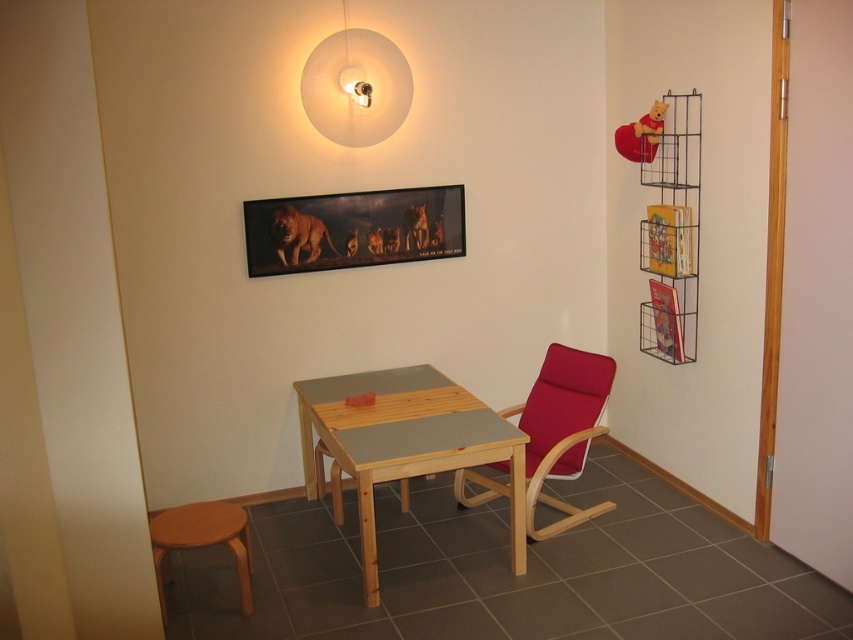
In the scene shown: Between light brown wooden table at center and metallic glossy picture frame at upper center, which one has more height?

light brown wooden table at center

You are a GUI agent. You are given a task and a screenshot of the screen. Output one action in this format:
    pyautogui.click(x=<x>, y=<y>)
    Task: Click on the light brown wooden table at center
    This screenshot has width=853, height=640.
    Given the screenshot: What is the action you would take?
    pyautogui.click(x=405, y=442)

Between light brown wooden table at center and matte red chair at center, which one appears on the right side from the viewer's perspective?

From the viewer's perspective, matte red chair at center appears more on the right side.

Can you confirm if light brown wooden table at center is wider than matte red chair at center?

Indeed, light brown wooden table at center has a greater width compared to matte red chair at center.

You are a GUI agent. You are given a task and a screenshot of the screen. Output one action in this format:
    pyautogui.click(x=<x>, y=<y>)
    Task: Click on the light brown wooden table at center
    
    Given the screenshot: What is the action you would take?
    pyautogui.click(x=405, y=442)

Does metallic glossy picture frame at upper center appear on the right side of wooden stool at lower left?

Yes, metallic glossy picture frame at upper center is to the right of wooden stool at lower left.

Does metallic glossy picture frame at upper center have a greater width compared to wooden stool at lower left?

Yes.

Does point (279, 224) come in front of point (248, 573)?

No.

Where is `metallic glossy picture frame at upper center`? This screenshot has width=853, height=640. metallic glossy picture frame at upper center is located at coordinates (352, 228).